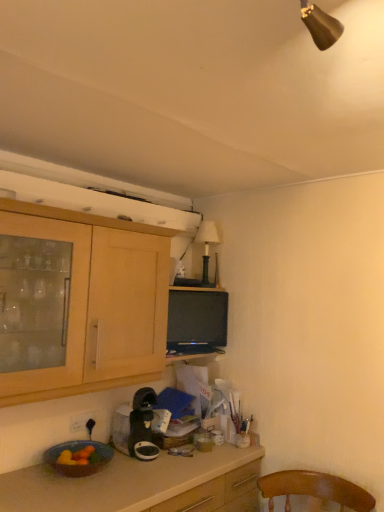
What is the approximate width of black plastic coffee maker at lower center?

33.20 centimeters.

What do you see at coordinates (98, 303) in the screenshot?
I see `light wood cabinet at upper left` at bounding box center [98, 303].

At what (x,y) coordinates should I click in order to perform the action: click on matte ceramic bowl at lower left. Please return your answer as a coordinate pair (x, y). Looking at the image, I should click on (78, 465).

Measure the distance between white plastic power outlet at lower left and camera.

The distance of white plastic power outlet at lower left from camera is 2.16 meters.

Measure the distance between point (92, 419) and camera.

They are 7.41 feet apart.

Locate an element on the screen. The image size is (384, 512). matte black tv at center is located at coordinates (197, 321).

Identify the location of power outlet on the left of light wood cabinet at upper left. (83, 420).

Would you consider white plastic power outlet at lower left to be distant from light wood cabinet at upper left?

No, white plastic power outlet at lower left is not far away from light wood cabinet at upper left.

Can you confirm if white plastic power outlet at lower left is taller than light wood cabinet at upper left?

No, white plastic power outlet at lower left is not taller than light wood cabinet at upper left.

From a real-world perspective, which object stands above the other?

light wood cabinet at upper left, from a real-world perspective.

Which is further, (122, 442) or (157, 357)?

The point (157, 357) is more distant.

From a real-world perspective, is black plastic coffee maker at lower center above or below light wood cabinet at upper left?

black plastic coffee maker at lower center is below light wood cabinet at upper left.

In the scene shown: What's the angular difference between black plastic coffee maker at lower center and light wood cabinet at upper left's facing directions?

They differ by 0.179 degrees in their facing directions.

Is black plastic coffee maker at lower center facing away from light wood cabinet at upper left?

No, black plastic coffee maker at lower center is not facing the opposite direction of light wood cabinet at upper left.

Considering the sizes of objects matte black tv at center and white plastic power outlet at lower left in the image provided, who is taller, matte black tv at center or white plastic power outlet at lower left?

matte black tv at center.

In the scene shown: From the image's perspective, between matte black tv at center and white plastic power outlet at lower left, which one is located above?

matte black tv at center is shown above in the image.

From a real-world perspective, is matte black tv at center positioned over white plastic power outlet at lower left based on gravity?

Yes, from a real-world perspective, matte black tv at center is over white plastic power outlet at lower left

Do you think matte black tv at center is within white plastic power outlet at lower left, or outside of it?

matte black tv at center is outside white plastic power outlet at lower left.

Can you tell me how much matte black tv at center and green matte lamp at upper center differ in facing direction?

matte black tv at center and green matte lamp at upper center are facing 22.5 degrees away from each other.

In the scene shown: Is matte black tv at center facing away from green matte lamp at upper center?

No, matte black tv at center's orientation is not away from green matte lamp at upper center.

From a real-world perspective, is matte black tv at center above or below green matte lamp at upper center?

From a real-world perspective, matte black tv at center is physically below green matte lamp at upper center.

Do you think matte black tv at center is within green matte lamp at upper center, or outside of it?

matte black tv at center is outside green matte lamp at upper center.

Considering their positions, is matte black tv at center located in front of or behind matte ceramic bowl at lower left?

In the image, matte black tv at center appears behind matte ceramic bowl at lower left.

Image resolution: width=384 pixels, height=512 pixels. I want to click on television to the right of matte ceramic bowl at lower left, so click(197, 321).

How far apart are matte black tv at center and matte ceramic bowl at lower left?

matte black tv at center and matte ceramic bowl at lower left are 32.31 inches apart.

From a real-world perspective, is matte black tv at center positioned above or below matte ceramic bowl at lower left?

From a real-world perspective, matte black tv at center is physically above matte ceramic bowl at lower left.

Are matte ceramic bowl at lower left and black plastic coffee maker at lower center making contact?

No, matte ceramic bowl at lower left is not in contact with black plastic coffee maker at lower center.

From the image's perspective, which object appears higher, matte ceramic bowl at lower left or black plastic coffee maker at lower center?

black plastic coffee maker at lower center.

Considering the relative sizes of matte ceramic bowl at lower left and black plastic coffee maker at lower center in the image provided, is matte ceramic bowl at lower left shorter than black plastic coffee maker at lower center?

Yes, matte ceramic bowl at lower left is shorter than black plastic coffee maker at lower center.

Is matte ceramic bowl at lower left facing away from black plastic coffee maker at lower center?

That's not correct — matte ceramic bowl at lower left is not looking away from black plastic coffee maker at lower center.

From the image's perspective, is matte black tv at center beneath light wood cabinet at upper left?

Yes, from the image's perspective, matte black tv at center is beneath light wood cabinet at upper left.

Is light wood cabinet at upper left at the back of matte black tv at center?

That's not correct — matte black tv at center is not looking away from light wood cabinet at upper left.

Locate an element on the screen. The image size is (384, 512). television located behind the light wood cabinet at upper left is located at coordinates (197, 321).

Image resolution: width=384 pixels, height=512 pixels. In order to click on cabinetry above the white plastic power outlet at lower left (from a real-world perspective) in this screenshot , I will do `click(98, 303)`.

Locate an element on the screen. This screenshot has height=512, width=384. cabinetry lying above the black plastic coffee maker at lower center (from the image's perspective) is located at coordinates (98, 303).

Based on their spatial positions, is white plastic power outlet at lower left or black plastic coffee maker at lower center closer to light wood cabinet at upper left?

black plastic coffee maker at lower center is positioned closer to the anchor light wood cabinet at upper left.

Consider the image. When comparing their distances from black plastic coffee maker at lower center, does light wood cabinet at upper left or matte ceramic bowl at lower left seem closer?

Among the two, matte ceramic bowl at lower left is located nearer to black plastic coffee maker at lower center.

Which object lies further to the anchor point white plastic power outlet at lower left, matte black tv at center or black plastic coffee maker at lower center?

The object further to white plastic power outlet at lower left is matte black tv at center.

Considering their positions, is matte ceramic bowl at lower left positioned closer to black plastic coffee maker at lower center than green matte lamp at upper center?

Among the two, matte ceramic bowl at lower left is located nearer to black plastic coffee maker at lower center.

Looking at the image, which one is located closer to light wood cabinet at upper left, green matte lamp at upper center or black plastic coffee maker at lower center?

black plastic coffee maker at lower center.

Based on their spatial positions, is white plastic power outlet at lower left or matte ceramic bowl at lower left closer to matte black tv at center?

Among the two, white plastic power outlet at lower left is located nearer to matte black tv at center.

Estimate the real-world distances between objects in this image. Which object is closer to white plastic power outlet at lower left, matte ceramic bowl at lower left or matte black tv at center?

Among the two, matte ceramic bowl at lower left is located nearer to white plastic power outlet at lower left.

Considering their positions, is matte black tv at center positioned closer to green matte lamp at upper center than black plastic coffee maker at lower center?

matte black tv at center is closer to green matte lamp at upper center.

Identify the location of bowl situated between white plastic power outlet at lower left and matte black tv at center from left to right. (78, 465).

This screenshot has width=384, height=512. I want to click on power outlet between light wood cabinet at upper left and matte black tv at center from front to back, so click(83, 420).

You are a GUI agent. You are given a task and a screenshot of the screen. Output one action in this format:
    pyautogui.click(x=<x>, y=<y>)
    Task: Click on the power outlet between light wood cabinet at upper left and matte ceramic bowl at lower left from top to bottom
    
    Given the screenshot: What is the action you would take?
    coord(83,420)

Identify the location of television between green matte lamp at upper center and white plastic power outlet at lower left vertically. (197, 321).